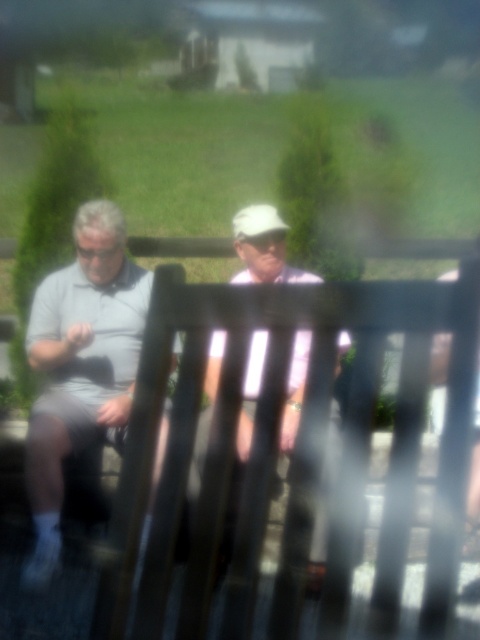
Is point (190, 497) closer to viewer compared to point (240, 221)?

That is True.

Can you confirm if white matte shirt at center is shorter than white matte baseball hat at center?

No.

Based on the photo, who is more distant from viewer, (189, 506) or (282, 220)?

Point (282, 220)

In order to click on white matte shirt at center in this screenshot , I will do `click(242, 442)`.

This screenshot has width=480, height=640. I want to click on gray matte shirt at left, so click(x=81, y=365).

Does point (120, 214) lie behind point (262, 204)?

No.

Where is `gray matte shirt at left`? gray matte shirt at left is located at coordinates (81, 365).

Find the location of `gray matte shirt at left`. gray matte shirt at left is located at coordinates (81, 365).